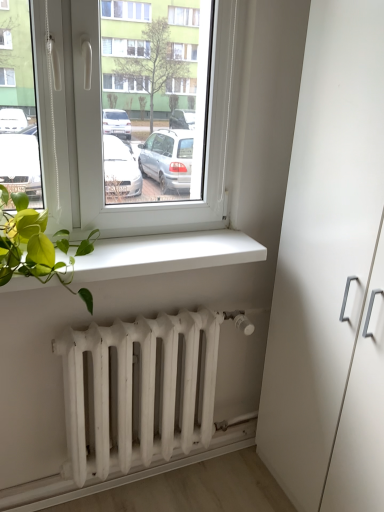
Question: Is white matte radiator at lower center facing towards white matte window sill at lower center?

Choices:
 (A) yes
 (B) no

Answer: (B)

Question: Can you confirm if white matte radiator at lower center is positioned to the right of white matte window sill at lower center?

Choices:
 (A) no
 (B) yes

Answer: (A)

Question: Considering the relative positions of white matte radiator at lower center and white matte window sill at lower center in the image provided, is white matte radiator at lower center to the left of white matte window sill at lower center from the viewer's perspective?

Choices:
 (A) yes
 (B) no

Answer: (A)

Question: Can we say white matte radiator at lower center lies outside white matte window sill at lower center?

Choices:
 (A) no
 (B) yes

Answer: (B)

Question: From the image's perspective, would you say white matte radiator at lower center is shown under white matte window sill at lower center?

Choices:
 (A) yes
 (B) no

Answer: (A)

Question: From the image's perspective, is white matte radiator at lower center on white matte window sill at lower center?

Choices:
 (A) no
 (B) yes

Answer: (A)

Question: Can you confirm if white matte window sill at lower center is wider than white matte radiator at lower center?

Choices:
 (A) yes
 (B) no

Answer: (A)

Question: Is white matte window sill at lower center shorter than white matte radiator at lower center?

Choices:
 (A) no
 (B) yes

Answer: (B)

Question: From the image's perspective, is white matte window sill at lower center located above white matte radiator at lower center?

Choices:
 (A) no
 (B) yes

Answer: (B)

Question: Does white matte window sill at lower center have a smaller size compared to white matte radiator at lower center?

Choices:
 (A) yes
 (B) no

Answer: (B)

Question: Does white matte window sill at lower center lie in front of white matte radiator at lower center?

Choices:
 (A) no
 (B) yes

Answer: (B)

Question: Is white matte window sill at lower center to the left of white matte radiator at lower center from the viewer's perspective?

Choices:
 (A) yes
 (B) no

Answer: (B)

Question: Considering the relative sizes of white matte cabinet at right and white matte window sill at lower center in the image provided, is white matte cabinet at right shorter than white matte window sill at lower center?

Choices:
 (A) no
 (B) yes

Answer: (A)